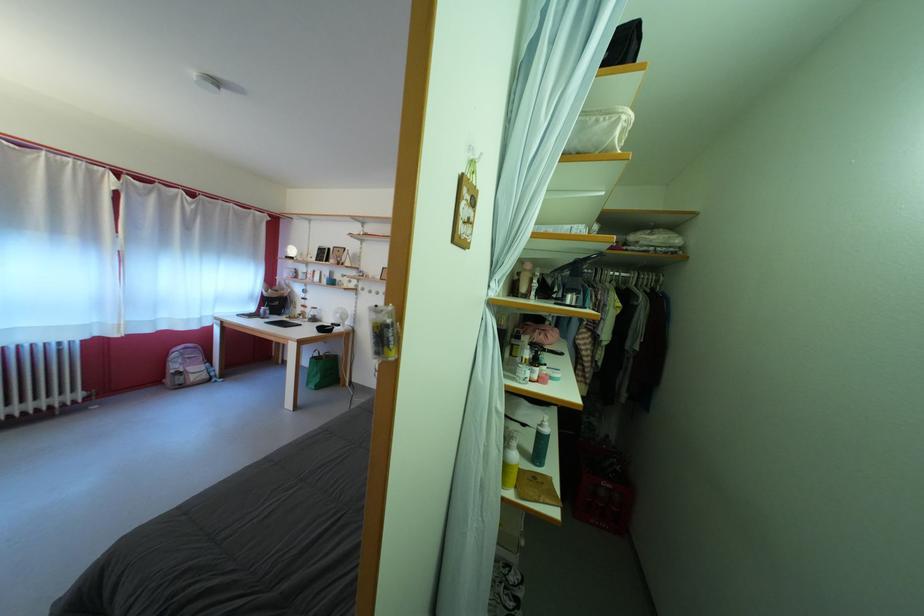
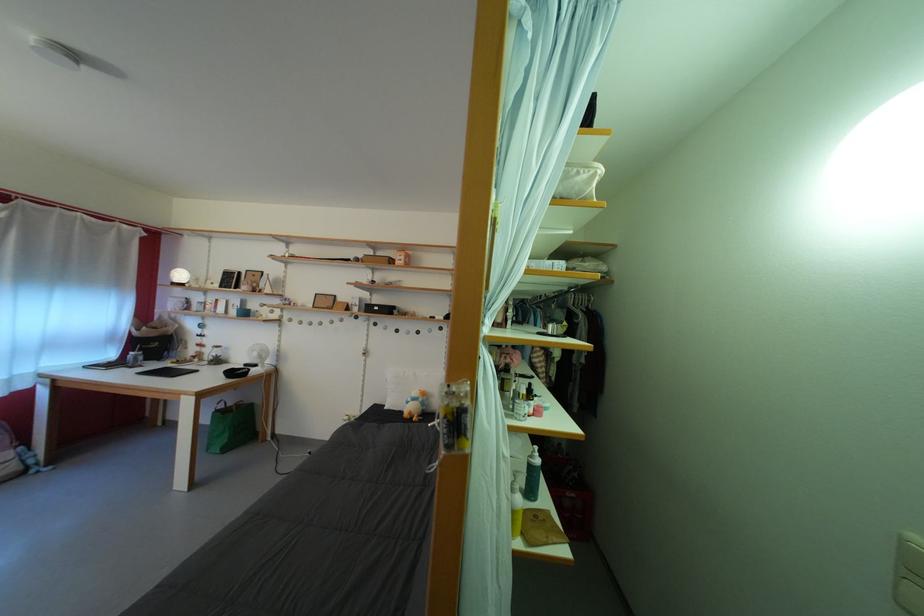
Find the pixel in the second image that matches point (346, 322) in the first image.

(263, 360)